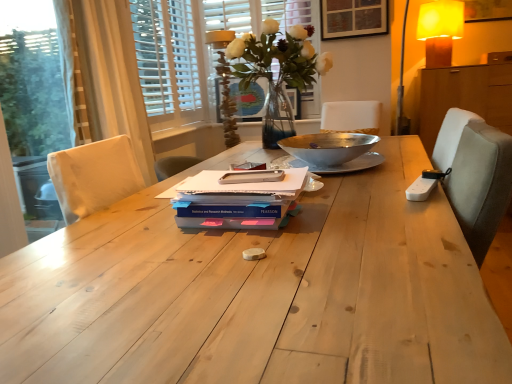
Question: Considering their positions, is blue matte paperback book at center, the third paperback book viewed from the top, located in front of or behind translucent glass vase at center?

Choices:
 (A) front
 (B) behind

Answer: (A)

Question: From the image's perspective, is blue matte paperback book at center, which appears as the first paperback book when ordered from the bottom, positioned above or below translucent glass vase at center?

Choices:
 (A) below
 (B) above

Answer: (A)

Question: Which object is the farthest from the yellow fabric lampshade at upper right, which is counted as the second table lamp, starting from the bottom?

Choices:
 (A) blue matte paperback book at center, which appears as the first paperback book when ordered from the bottom
 (B) metallic silver bowl at center
 (C) translucent glass vase at center
 (D) white matte notebook at center, the 3th paperback book positioned from the bottom
 (E) white fabric curtain at left

Answer: (A)

Question: Estimate the real-world distances between objects in this image. Which object is farther from the white matte notebook at center, the 3th paperback book positioned from the bottom?

Choices:
 (A) yellow fabric lampshade at upper right, which is counted as the second table lamp, starting from the bottom
 (B) translucent glass vase at center
 (C) white wooden blinds at upper left, the first bay window in the left-to-right sequence
 (D) matte glass vase at upper center, arranged as the first table lamp when viewed from the left
 (E) pearlescent paper at center, the 2th paperback book from the top

Answer: (A)